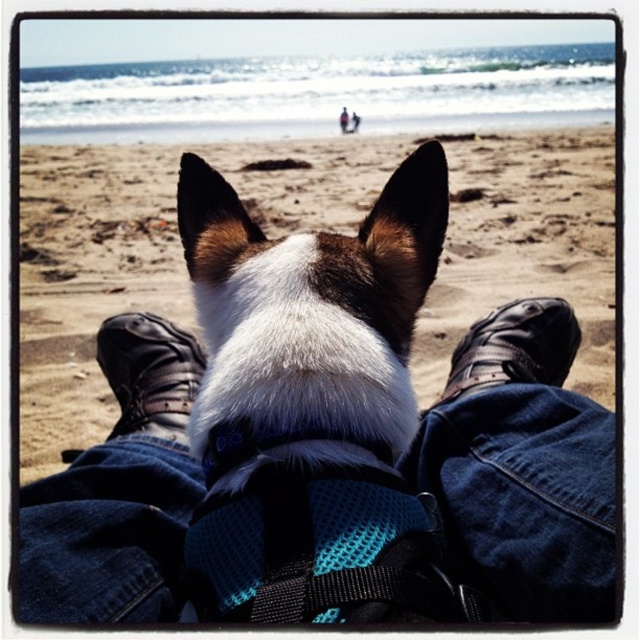
This screenshot has height=640, width=640. Describe the element at coordinates (305, 388) in the screenshot. I see `white fur at center` at that location.

At what (x,y) coordinates should I click in order to perform the action: click on white fur at center. Please return your answer as a coordinate pair (x, y). The height and width of the screenshot is (640, 640). Looking at the image, I should click on (305, 388).

What do you see at coordinates (305, 388) in the screenshot? Image resolution: width=640 pixels, height=640 pixels. I see `white fur at center` at bounding box center [305, 388].

Where is `white fur at center`? This screenshot has width=640, height=640. white fur at center is located at coordinates (305, 388).

Where is `white fur dog at center`? Image resolution: width=640 pixels, height=640 pixels. white fur dog at center is located at coordinates (88, 280).

Does white fur dog at center appear under black leather shoe at lower center?

No, white fur dog at center is not below black leather shoe at lower center.

Who is more distant from viewer, (492,141) or (561,314)?

Positioned behind is point (492,141).

The width and height of the screenshot is (640, 640). Identify the location of white fur dog at center. (88, 280).

Does white fur at center have a larger size compared to black leather shoe at lower center?

No, white fur at center is not bigger than black leather shoe at lower center.

Does white fur at center appear over black leather shoe at lower center?

Indeed, white fur at center is positioned over black leather shoe at lower center.

Does point (202, 428) lie behind point (531, 372)?

No, it is in front of (531, 372).

The image size is (640, 640). In order to click on white fur at center in this screenshot , I will do `click(305, 388)`.